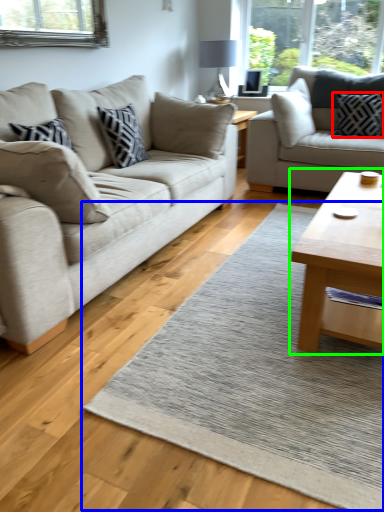
Question: Estimate the real-world distances between objects in this image. Which object is farther from pillow (highlighted by a red box), mat (highlighted by a blue box) or coffee table (highlighted by a green box)?

Choices:
 (A) mat
 (B) coffee table

Answer: (A)